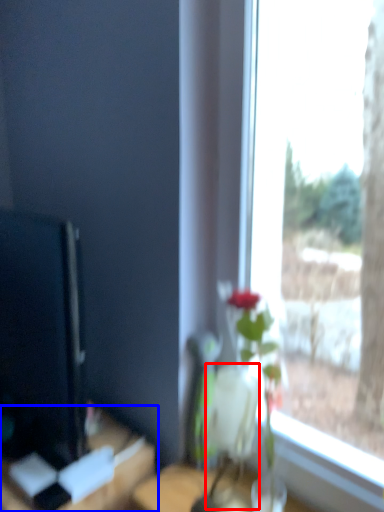
Question: Which of the following is the farthest to the observer, vase (highlighted by a red box) or table (highlighted by a blue box)?

Choices:
 (A) vase
 (B) table

Answer: (B)